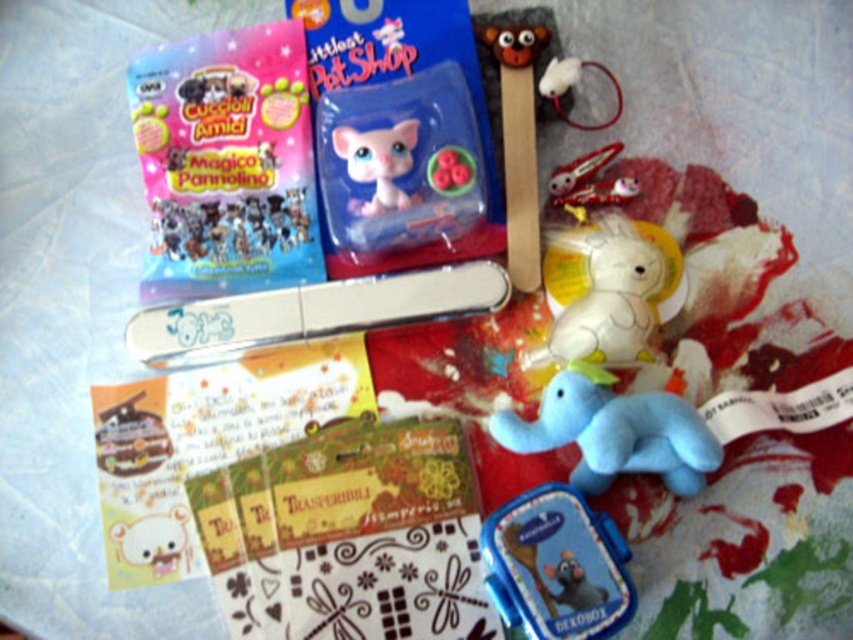
You are holding a ruler that is 36 inches long. You want to measure the distance from the camera to the transperibile paper at center. Can your ruler reach that distance?

The distance between the transperibile paper at center and the camera is 38.86 inches. Since your ruler is only 36 inches long, it cannot reach the full distance.

You are organizing a childrens birthday party and need to place the blue plastic lunchbox at lower center and the white plush unicorn at upper center on a shelf. Which object should you place first to ensure proper arrangement?

You should place the white plush unicorn at upper center first because the blue plastic lunchbox at lower center is positioned under it, meaning the unicorn needs to be placed on the shelf first to allow the lunchbox to be placed beneath it.

You are organizing a craft station and need to place the transperibile paper at center and the metallic silver nail file at center. Which item is closer to you on the table?

The transperibile paper at center is closer to the viewer than the metallic silver nail file at center, so it is closer.